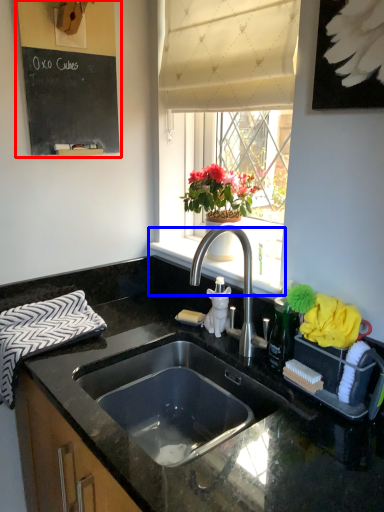
Question: Among these objects, which one is nearest to the camera, bulletin board (highlighted by a red box) or window sill (highlighted by a blue box)?

Choices:
 (A) bulletin board
 (B) window sill

Answer: (A)